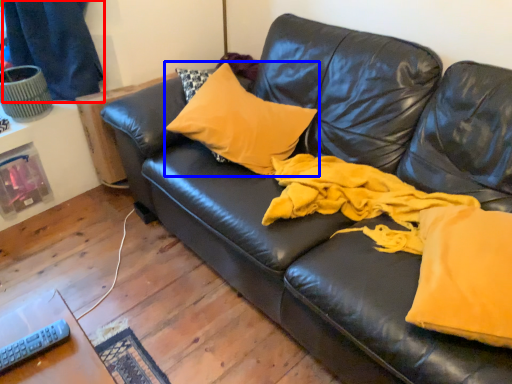
Question: Which object appears farthest to the camera in this image, curtain (highlighted by a red box) or pillow (highlighted by a blue box)?

Choices:
 (A) curtain
 (B) pillow

Answer: (A)